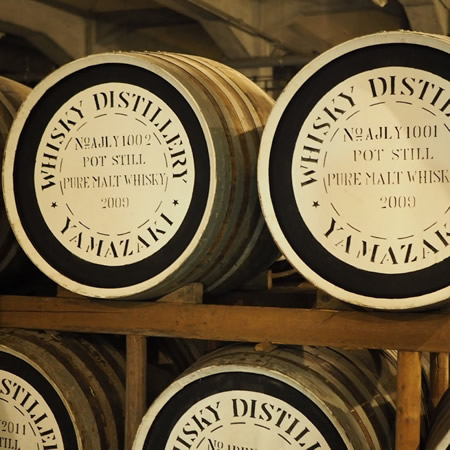
The image size is (450, 450). Find the location of `wood beam horizontal`. wood beam horizontal is located at coordinates (263, 324).